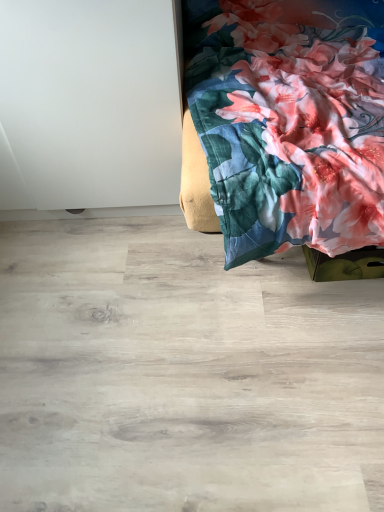
At what (x,y) coordinates should I click in order to perform the action: click on natural wood floor at lower center. Please return your answer as a coordinate pair (x, y). The height and width of the screenshot is (512, 384). Looking at the image, I should click on (182, 374).

What do you see at coordinates (182, 374) in the screenshot?
I see `natural wood floor at lower center` at bounding box center [182, 374].

In order to face natural wood floor at lower center, should I rotate leftwards or rightwards?

Rotate your view left by about 4.143°.

What is the approximate width of floral fabric bedspread at upper right?

floral fabric bedspread at upper right is 1.03 meters wide.

At what (x,y) coordinates should I click in order to perform the action: click on floral fabric bedspread at upper right. Please return your answer as a coordinate pair (x, y). This screenshot has height=512, width=384. Looking at the image, I should click on (290, 120).

This screenshot has width=384, height=512. Describe the element at coordinates (290, 120) in the screenshot. I see `floral fabric bedspread at upper right` at that location.

Locate an element on the screen. natural wood floor at lower center is located at coordinates (182, 374).

Is natural wood floor at lower center at the right side of floral fabric bedspread at upper right?

No.

Relative to floral fabric bedspread at upper right, is natural wood floor at lower center in front or behind?

Clearly, natural wood floor at lower center is behind floral fabric bedspread at upper right.

Which is nearer, (238, 458) or (275, 232)?

Point (238, 458) appears to be closer to the viewer than point (275, 232).

From the image's perspective, is natural wood floor at lower center located above or below floral fabric bedspread at upper right?

natural wood floor at lower center is below floral fabric bedspread at upper right.

From a real-world perspective, is natural wood floor at lower center above or below floral fabric bedspread at upper right?

natural wood floor at lower center is situated lower than floral fabric bedspread at upper right in the real world.

In terms of width, does natural wood floor at lower center look wider or thinner when compared to floral fabric bedspread at upper right?

In the image, natural wood floor at lower center appears to be wider than floral fabric bedspread at upper right.

In terms of height, does natural wood floor at lower center look taller or shorter compared to floral fabric bedspread at upper right?

Clearly, natural wood floor at lower center is shorter compared to floral fabric bedspread at upper right.

Who is bigger, natural wood floor at lower center or floral fabric bedspread at upper right?

Bigger between the two is floral fabric bedspread at upper right.

Can we say natural wood floor at lower center lies outside floral fabric bedspread at upper right?

Yes, natural wood floor at lower center is located beyond the bounds of floral fabric bedspread at upper right.

Is natural wood floor at lower center beside floral fabric bedspread at upper right?

No, natural wood floor at lower center is not in contact with floral fabric bedspread at upper right.

Is natural wood floor at lower center turned away from floral fabric bedspread at upper right?

natural wood floor at lower center does not have its back to floral fabric bedspread at upper right.

Looking at this image, how different are the orientations of natural wood floor at lower center and floral fabric bedspread at upper right in degrees?

The angle between the facing direction of natural wood floor at lower center and the facing direction of floral fabric bedspread at upper right is 0.72 degrees.

Locate an element on the screen. Image resolution: width=384 pixels, height=512 pixels. plywood on the left of the floral fabric bedspread at upper right is located at coordinates (182, 374).

Based on their positions, is floral fabric bedspread at upper right located to the left or right of natural wood floor at lower center?

From the image, it's evident that floral fabric bedspread at upper right is to the right of natural wood floor at lower center.

In the image, is floral fabric bedspread at upper right positioned in front of or behind natural wood floor at lower center?

floral fabric bedspread at upper right is in front of natural wood floor at lower center.

Which is nearer, (232, 221) or (7, 229)?

Point (232, 221) is closer to the camera than point (7, 229).

From the image's perspective, is floral fabric bedspread at upper right below natural wood floor at lower center?

Actually, floral fabric bedspread at upper right appears above natural wood floor at lower center in the image.

From a real-world perspective, is floral fabric bedspread at upper right positioned under natural wood floor at lower center based on gravity?

Incorrect, from a real-world perspective, floral fabric bedspread at upper right is higher than natural wood floor at lower center.

Is floral fabric bedspread at upper right thinner than natural wood floor at lower center?

Yes.

Is floral fabric bedspread at upper right taller than natural wood floor at lower center?

Yes, floral fabric bedspread at upper right is taller than natural wood floor at lower center.

Is floral fabric bedspread at upper right bigger or smaller than natural wood floor at lower center?

In the image, floral fabric bedspread at upper right appears to be larger than natural wood floor at lower center.

Is floral fabric bedspread at upper right situated inside natural wood floor at lower center or outside?

floral fabric bedspread at upper right is located beyond the bounds of natural wood floor at lower center.

Is floral fabric bedspread at upper right beside natural wood floor at lower center?

No.

Could you tell me if floral fabric bedspread at upper right is facing natural wood floor at lower center?

No.

Measure the distance from floral fabric bedspread at upper right to natural wood floor at lower center.

49.68 centimeters.

This screenshot has height=512, width=384. I want to click on plywood that appears below the floral fabric bedspread at upper right (from the image's perspective), so click(x=182, y=374).

This screenshot has height=512, width=384. I want to click on furniture that is on the right side of natural wood floor at lower center, so click(x=290, y=120).

There is a natural wood floor at lower center. At what (x,y) coordinates should I click in order to perform the action: click on furniture above it (from a real-world perspective). Please return your answer as a coordinate pair (x, y). The width and height of the screenshot is (384, 512). Looking at the image, I should click on (290, 120).